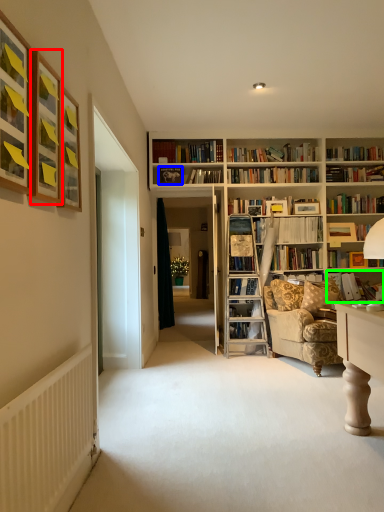
Question: Based on their relative distances, which object is farther from picture frame (highlighted by a red box)? Choose from picture frame (highlighted by a blue box) and book (highlighted by a green box).

Choices:
 (A) picture frame
 (B) book

Answer: (B)